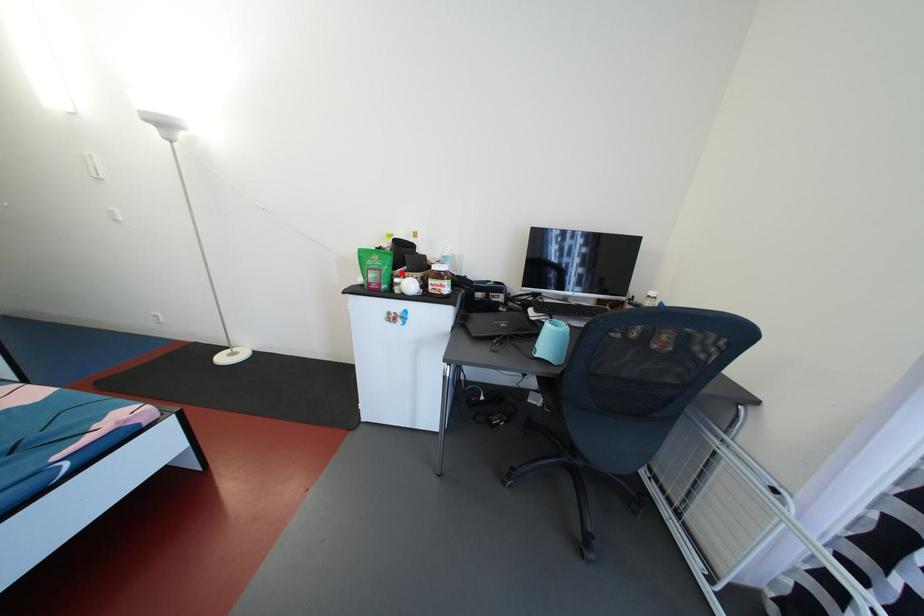
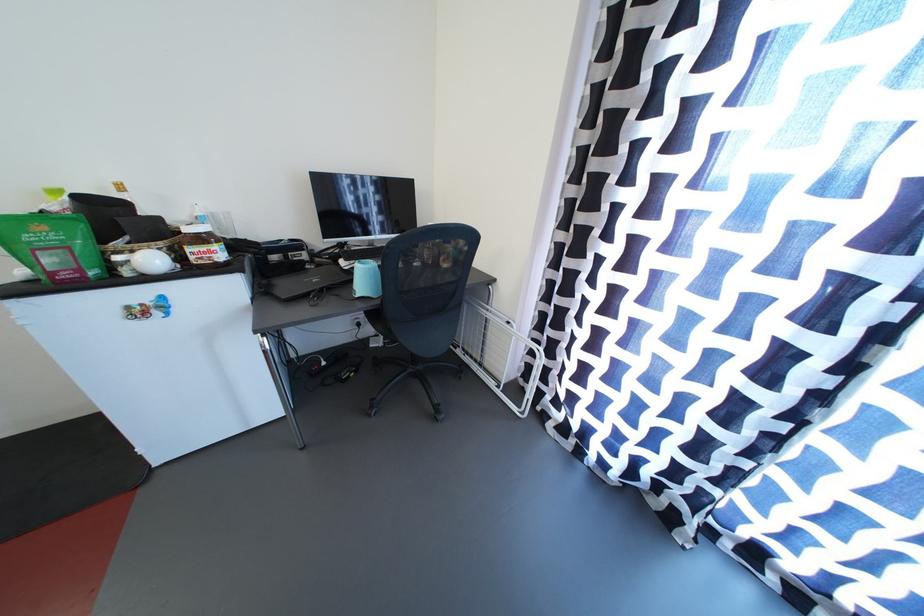
The point at the highlighted location is marked in the first image. Where is the corresponding point in the second image?

(110, 246)